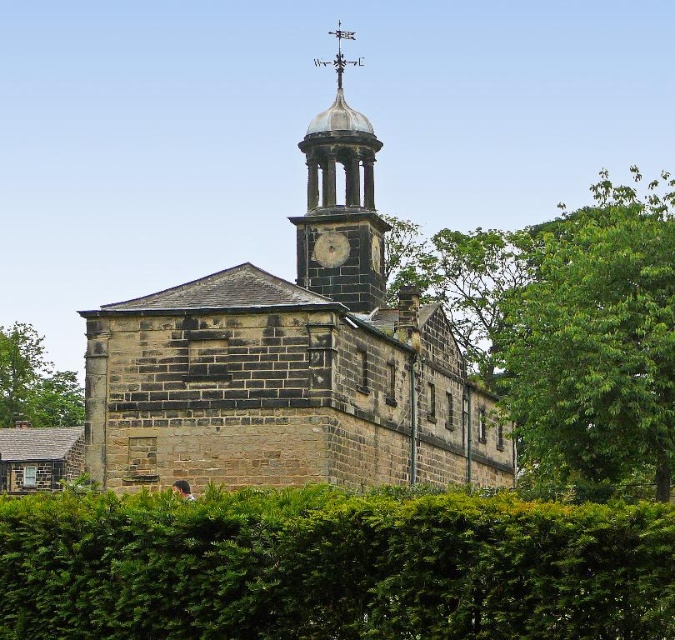
Is dark gray stone clock tower at upper center smaller than metallic clock face at center?

No, dark gray stone clock tower at upper center is not smaller than metallic clock face at center.

Between dark gray stone clock tower at upper center and metallic clock face at center, which one is positioned higher?

dark gray stone clock tower at upper center is higher up.

Image resolution: width=675 pixels, height=640 pixels. What do you see at coordinates (340, 204) in the screenshot?
I see `dark gray stone clock tower at upper center` at bounding box center [340, 204].

Where is `dark gray stone clock tower at upper center`? This screenshot has height=640, width=675. dark gray stone clock tower at upper center is located at coordinates (340, 204).

Is point (483, 451) closer to viewer compared to point (551, 397)?

No, (483, 451) is behind (551, 397).

Does brown stone church at center appear on the left side of green leafy tree at upper right?

Yes, brown stone church at center is to the left of green leafy tree at upper right.

Identify the location of brown stone church at center. The image size is (675, 640). (292, 360).

Where is `brown stone church at center`? This screenshot has width=675, height=640. brown stone church at center is located at coordinates (292, 360).

Which of these two, dark gray stone clock tower at upper center or green leafy tree at lower left, stands shorter?

green leafy tree at lower left is shorter.

Between dark gray stone clock tower at upper center and green leafy tree at lower left, which one has more height?

Standing taller between the two is dark gray stone clock tower at upper center.

Locate an element on the screen. This screenshot has height=640, width=675. dark gray stone clock tower at upper center is located at coordinates (340, 204).